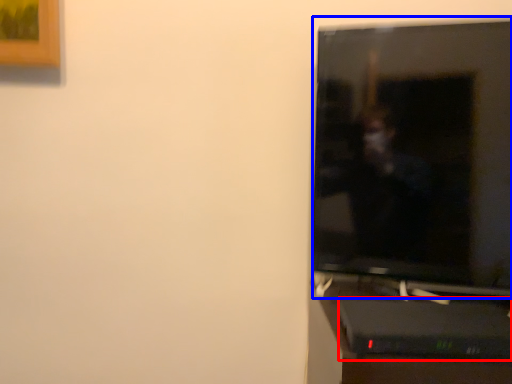
Question: Which of the following is the farthest to the observer, computer desk (highlighted by a red box) or television (highlighted by a blue box)?

Choices:
 (A) computer desk
 (B) television

Answer: (B)